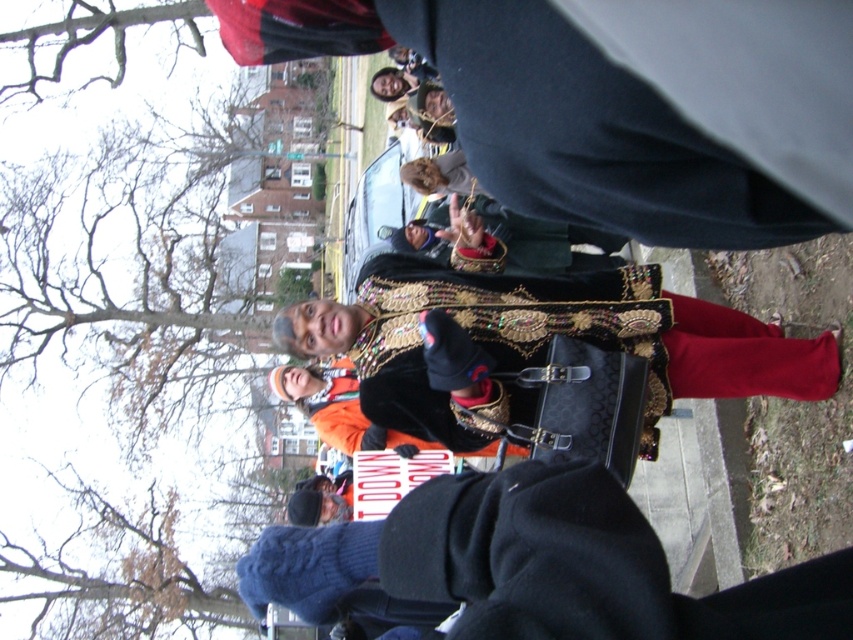
Does knitted wool sweater at lower center appear on the left side of velvet black cape at center?

Indeed, knitted wool sweater at lower center is positioned on the left side of velvet black cape at center.

Can you confirm if knitted wool sweater at lower center is positioned above velvet black cape at center?

No.

Between point (642, 627) and point (715, 362), which one is positioned behind?

The point (715, 362) is behind.

Locate an element on the screen. knitted wool sweater at lower center is located at coordinates (535, 564).